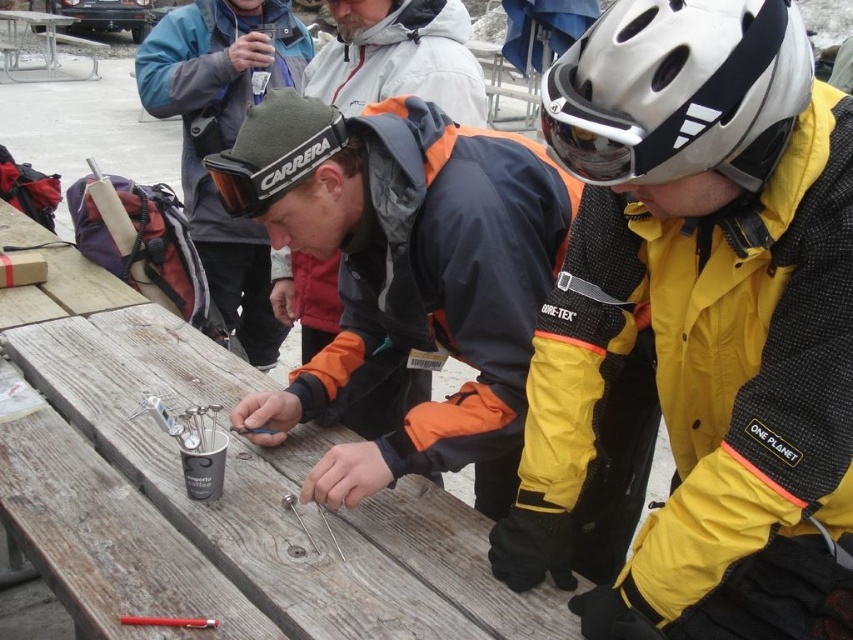
Question: Among these objects, which one is nearest to the camera?

Choices:
 (A) orange and black jacket at center
 (B) wooden table at center

Answer: (B)

Question: Can you confirm if yellow gore-tex jacket at center is positioned above white matte bicycle helmet at upper center?

Choices:
 (A) no
 (B) yes

Answer: (A)

Question: Does orange and black jacket at center appear on the right side of white matte bicycle helmet at upper center?

Choices:
 (A) no
 (B) yes

Answer: (A)

Question: Which object is closer to the camera taking this photo?

Choices:
 (A) black matte goggles at center
 (B) orange and black jacket at center

Answer: (B)

Question: Based on their relative distances, which object is farther from the black matte goggles at center?

Choices:
 (A) white matte bicycle helmet at upper center
 (B) orange ski goggles at center

Answer: (B)

Question: In this image, where is white matte bicycle helmet at upper center located relative to orange ski goggles at center?

Choices:
 (A) above
 (B) below

Answer: (B)